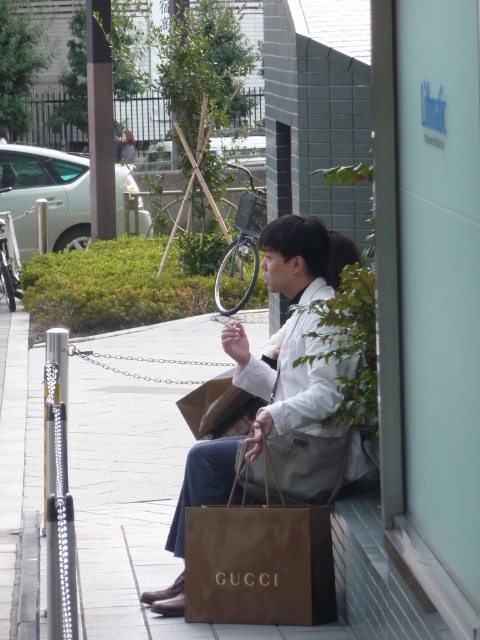
Is brown paper bag at center wider than matte brown paper bag at center?

Yes, brown paper bag at center is wider than matte brown paper bag at center.

Does brown paper bag at center have a smaller size compared to matte brown paper bag at center?

No, brown paper bag at center is not smaller than matte brown paper bag at center.

Which is behind, point (259, 602) or point (123, 141)?

Point (123, 141)

This screenshot has width=480, height=640. I want to click on brown paper bag at center, so click(x=259, y=560).

Who is taller, white matte jacket at center or brown paper bag at center?

white matte jacket at center is taller.

Which is more to the right, white matte jacket at center or brown paper bag at center?

From the viewer's perspective, white matte jacket at center appears more on the right side.

The width and height of the screenshot is (480, 640). What are the coordinates of `white matte jacket at center` in the screenshot? It's located at (260, 412).

This screenshot has width=480, height=640. I want to click on white matte jacket at center, so click(260, 412).

Is white matte jacket at center thinner than matte brown paper bag at center?

Incorrect, white matte jacket at center's width is not less than matte brown paper bag at center's.

What do you see at coordinates (260, 412) in the screenshot? I see `white matte jacket at center` at bounding box center [260, 412].

Between point (296, 275) and point (129, 154), which one is positioned behind?

The point (129, 154) is more distant.

Find the location of `white matte jacket at center`. white matte jacket at center is located at coordinates (260, 412).